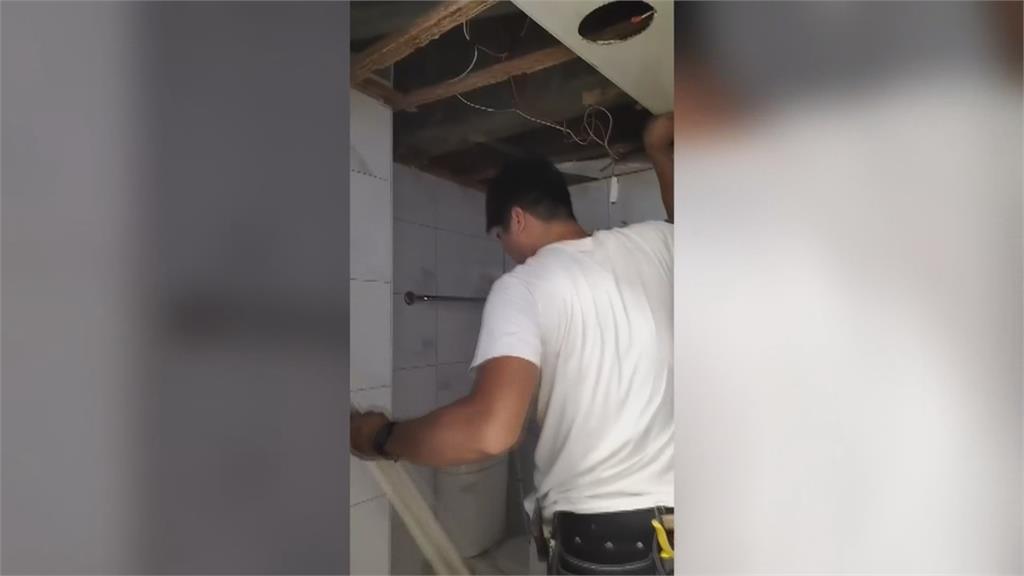
What are the coordinates of `floor joints` in the screenshot? It's located at (415, 41), (464, 79), (489, 170).